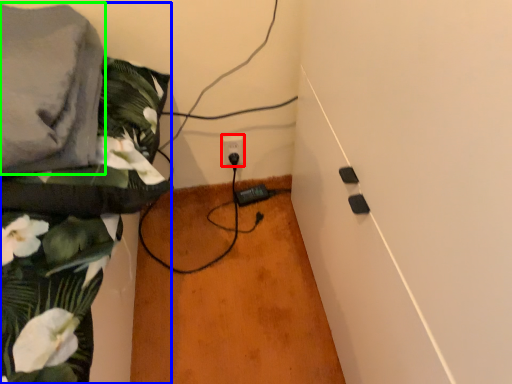
Question: Considering the real-world distances, which object is closest to power plugs and sockets (highlighted by a red box)? textile (highlighted by a blue box) or linen (highlighted by a green box).

Choices:
 (A) textile
 (B) linen

Answer: (A)